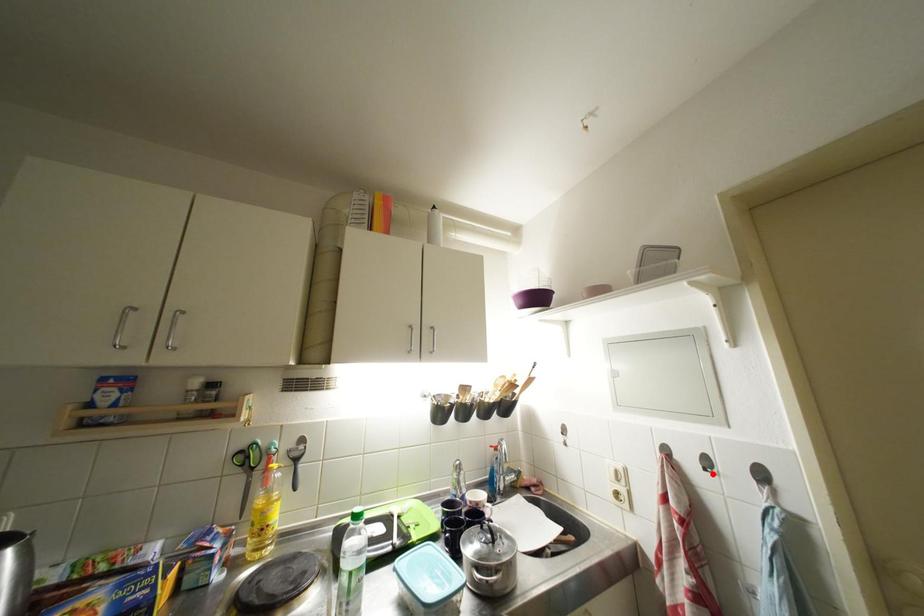
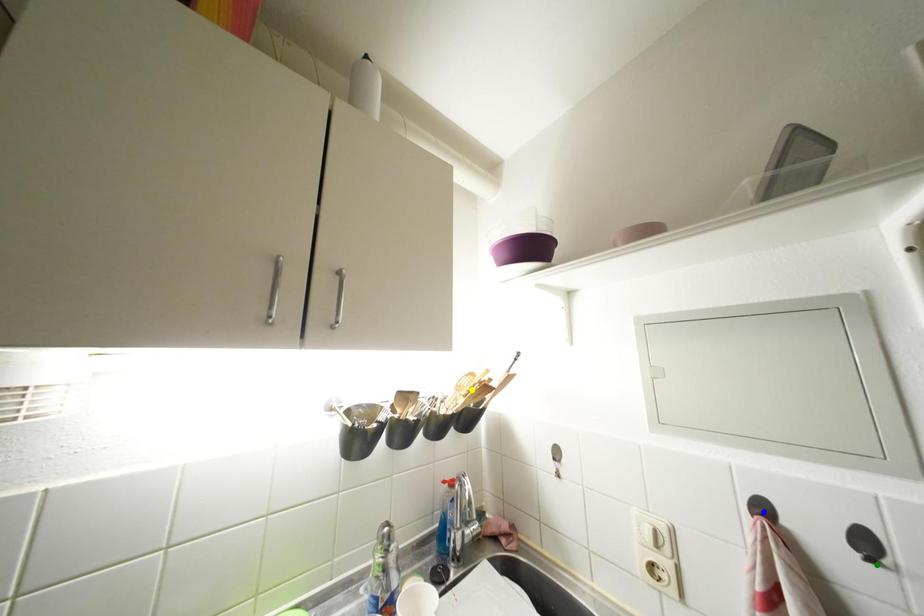
Question: I am providing you with two images of the same scene from different viewpoints. A red point is marked on the first image. You are given multiple points on the second image. Which mark in image 2 goes with the point in image 1?

Choices:
 (A) blue point
 (B) yellow point
 (C) green point

Answer: (C)